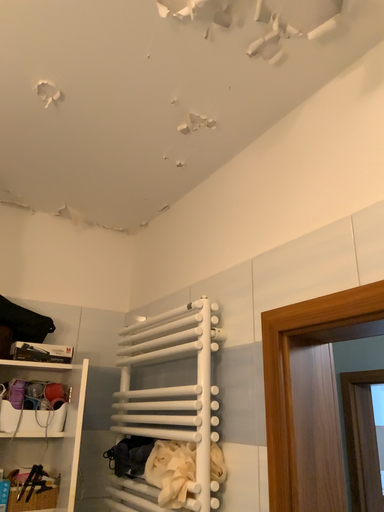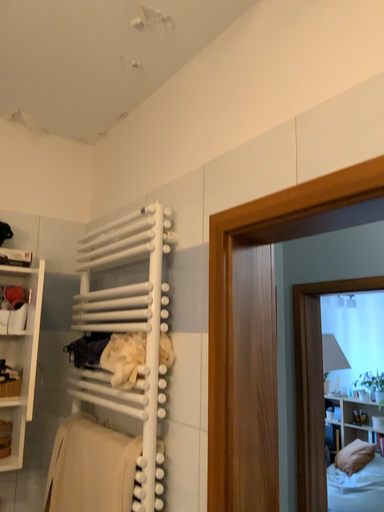
Question: How did the camera likely rotate when shooting the video?

Choices:
 (A) rotated downward
 (B) rotated upward

Answer: (A)